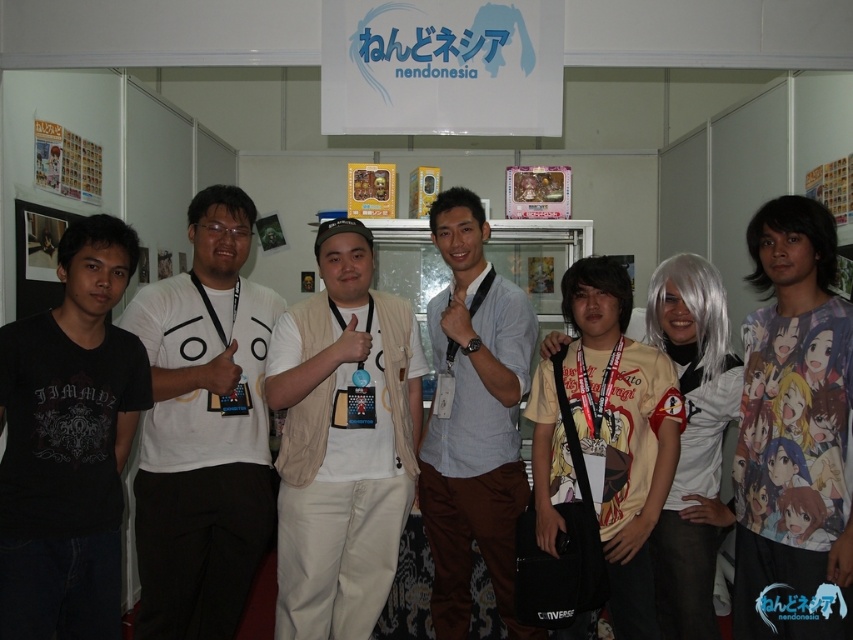
Question: Does printed fabric t-shirt at center appear over light blue shirt at center?

Choices:
 (A) no
 (B) yes

Answer: (B)

Question: Which object appears closest to the camera in this image?

Choices:
 (A) light blue shirt at center
 (B) printed fabric t-shirt at center
 (C) beige fabric vest at center
 (D) yellow printed t-shirt at center

Answer: (B)

Question: Which point is farther from the camera taking this photo?

Choices:
 (A) (813, 237)
 (B) (321, 483)
 (C) (173, 476)
 (D) (550, 387)

Answer: (D)

Question: Does black matte t-shirt at left lie in front of light blue shirt at center?

Choices:
 (A) yes
 (B) no

Answer: (A)

Question: Estimate the real-world distances between objects in this image. Which object is farther from the yellow printed t-shirt at center?

Choices:
 (A) beige fabric vest at center
 (B) printed fabric t-shirt at center
 (C) black matte t-shirt at left
 (D) white matte t-shirt at center

Answer: (C)

Question: Is printed fabric t-shirt at center to the left of yellow printed t-shirt at center from the viewer's perspective?

Choices:
 (A) no
 (B) yes

Answer: (A)